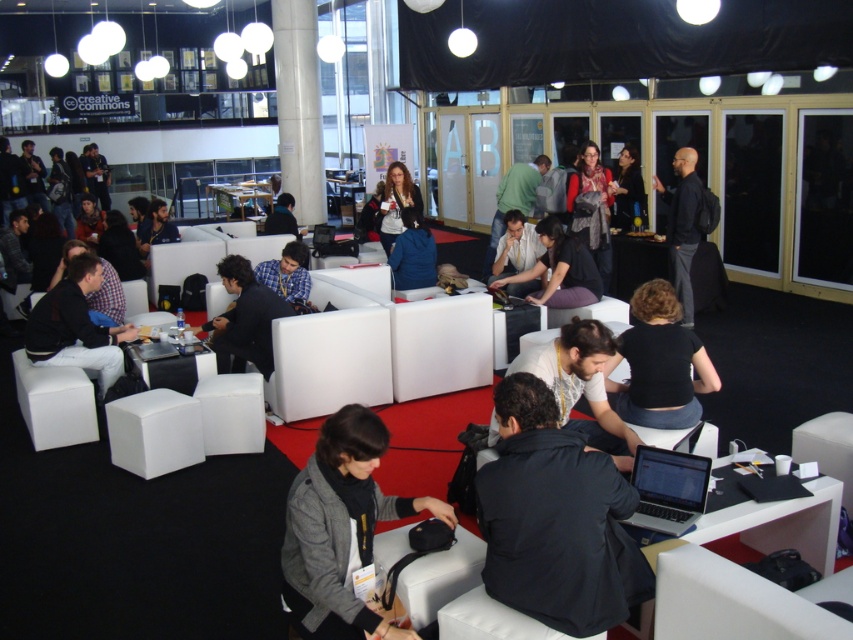
Question: Which object is closer to the camera taking this photo?

Choices:
 (A) plaid shirt at center
 (B) silver metallic laptop at lower center
 (C) matte white shirt at center
 (D) dark gray scarf at center

Answer: (B)

Question: Is white matte cube at lower left wider than white shirt at center?

Choices:
 (A) yes
 (B) no

Answer: (B)

Question: Which of the following is the farthest from the observer?

Choices:
 (A) (30, 365)
 (B) (386, 189)
 (C) (517, 172)

Answer: (C)

Question: Can you confirm if dark gray fabric jacket at center is positioned below dark gray scarf at center?

Choices:
 (A) no
 (B) yes

Answer: (B)

Question: Which is farther from the silver metallic laptop at lower center?

Choices:
 (A) matte black jacket at center
 (B) dark blue fabric jacket at lower center
 (C) matte black shirt at center

Answer: (C)

Question: Is matte white shirt at center thinner than dark gray scarf at center?

Choices:
 (A) yes
 (B) no

Answer: (A)